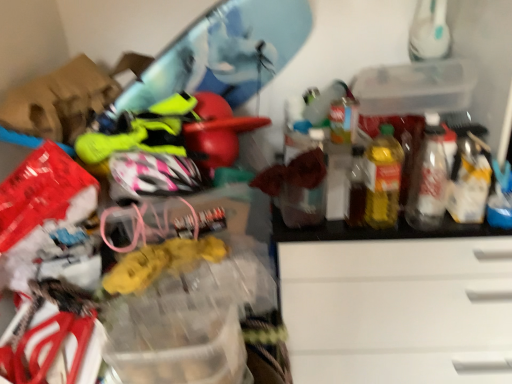
Question: Is yellow translucent bottle at right, which is the second bottle from right to left, inside the boundaries of translucent plastic bottle at right, which is counted as the 1th bottle, starting from the right, or outside?

Choices:
 (A) outside
 (B) inside

Answer: (A)

Question: Considering the positions of yellow translucent bottle at right, which is the second bottle from right to left, and translucent plastic bottle at right, positioned as the second bottle in left-to-right order, in the image, is yellow translucent bottle at right, which is the second bottle from right to left, wider or thinner than translucent plastic bottle at right, positioned as the second bottle in left-to-right order,?

Choices:
 (A) thin
 (B) wide

Answer: (B)

Question: Considering the real-world distances, which object is closest to the translucent plastic bottle at right, which is counted as the 1th bottle, starting from the right?

Choices:
 (A) transparent plastic storage box at upper right
 (B) yellow translucent bottle at right, which is the second bottle from right to left

Answer: (B)

Question: Which is farther from the yellow translucent bottle at right, which ranks as the 1th bottle in left-to-right order?

Choices:
 (A) translucent plastic bottle at right, which is counted as the 1th bottle, starting from the right
 (B) transparent plastic storage box at upper right

Answer: (B)